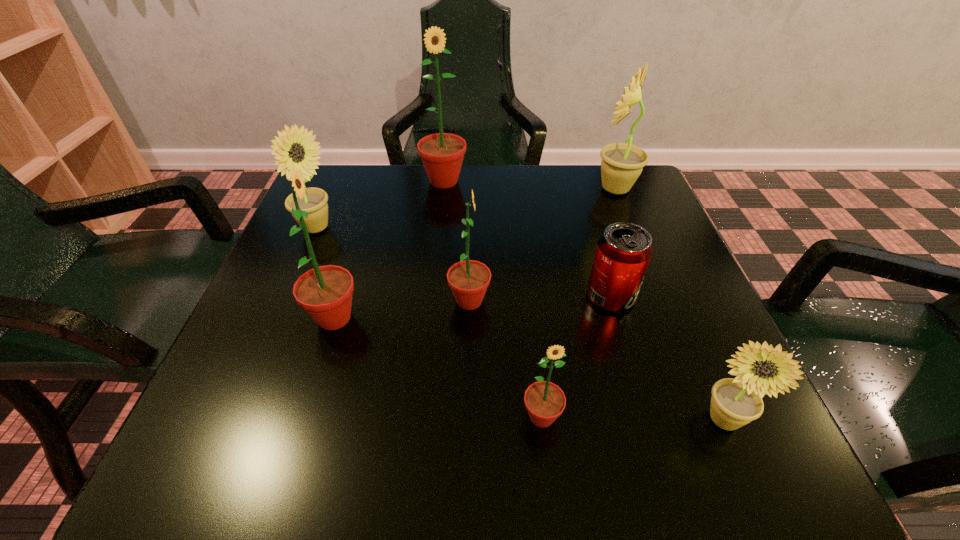
In the image, there is a desktop. Where is `vacant space at the far right corner`? This screenshot has height=540, width=960. vacant space at the far right corner is located at coordinates (630, 201).

The height and width of the screenshot is (540, 960). Find the location of `free space between the second smallest green sunflower and the soda can`. free space between the second smallest green sunflower and the soda can is located at coordinates (540, 299).

The image size is (960, 540). Find the location of `unoccupied position between the second farthest yellow sunflower and the second smallest green sunflower`. unoccupied position between the second farthest yellow sunflower and the second smallest green sunflower is located at coordinates (393, 265).

Identify the location of blank region between the fifth object from left to right and the second smallest green sunflower. (506, 359).

Where is `blank region between the second farthest yellow sunflower and the rightmost green sunflower`? This screenshot has width=960, height=540. blank region between the second farthest yellow sunflower and the rightmost green sunflower is located at coordinates (429, 323).

At what (x,y) coordinates should I click in order to perform the action: click on vacant point located between the leftmost green sunflower and the second smallest green sunflower. Please return your answer as a coordinate pair (x, y). Looking at the image, I should click on (402, 309).

Where is `free space between the soda can and the second smallest green sunflower`? This screenshot has height=540, width=960. free space between the soda can and the second smallest green sunflower is located at coordinates tap(540, 299).

Image resolution: width=960 pixels, height=540 pixels. Find the location of `free space between the soda can and the tallest sunflower`. free space between the soda can and the tallest sunflower is located at coordinates (527, 239).

Locate an element on the screen. This screenshot has height=540, width=960. vacant area that lies between the third biggest green sunflower and the farthest yellow sunflower is located at coordinates (542, 245).

This screenshot has height=540, width=960. I want to click on vacant region between the tallest object and the smallest yellow sunflower, so click(584, 300).